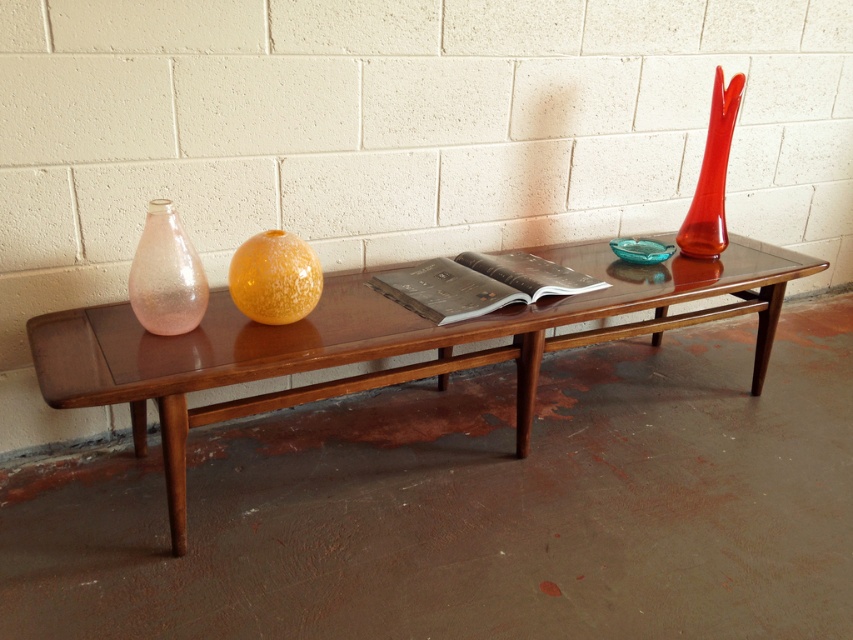
What are the coordinates of the glossy wood table at center?

The glossy wood table at center is located at point [380,342].

From the picture: You are standing in the room and want to place a 1.5 meter long decorative item on the glossy wood table at center. Can you fit it on the table without moving any existing items?

The glossy wood table at center is 1.36 meters away from the viewer, but the question of fitting a 1.5 meter long item depends on the table dimensions, which are not provided in the scene description. Therefore, it is uncertain if the item will fit.